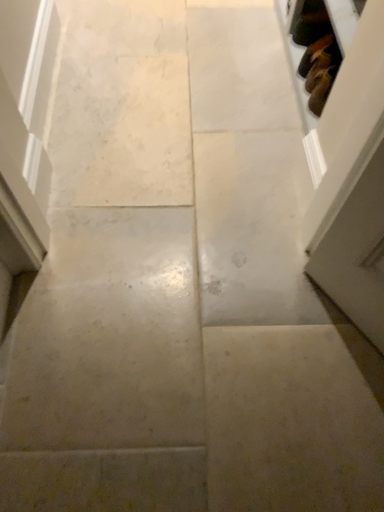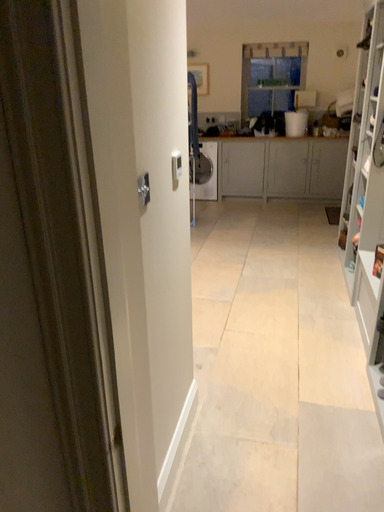
Question: Which way did the camera rotate in the video?

Choices:
 (A) rotated left
 (B) rotated right

Answer: (A)